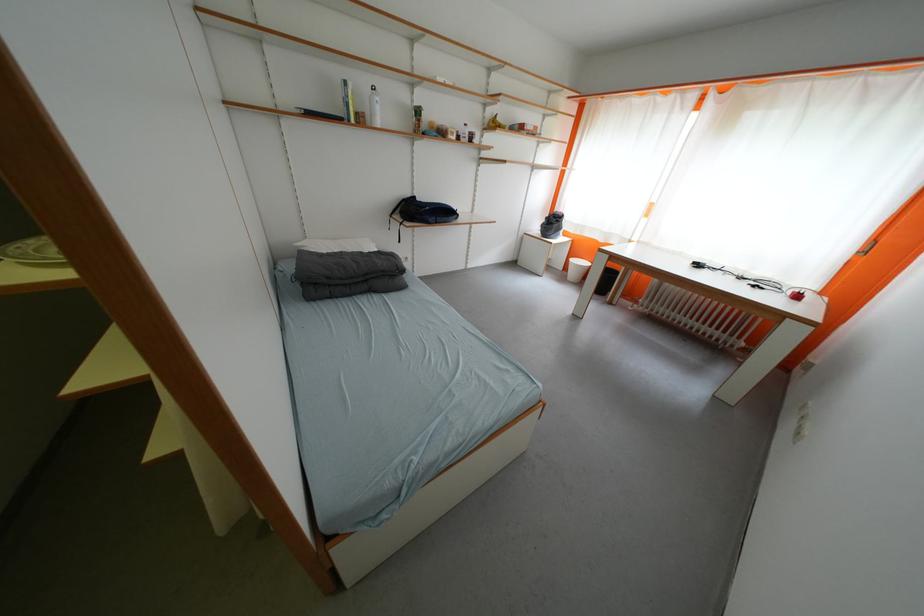
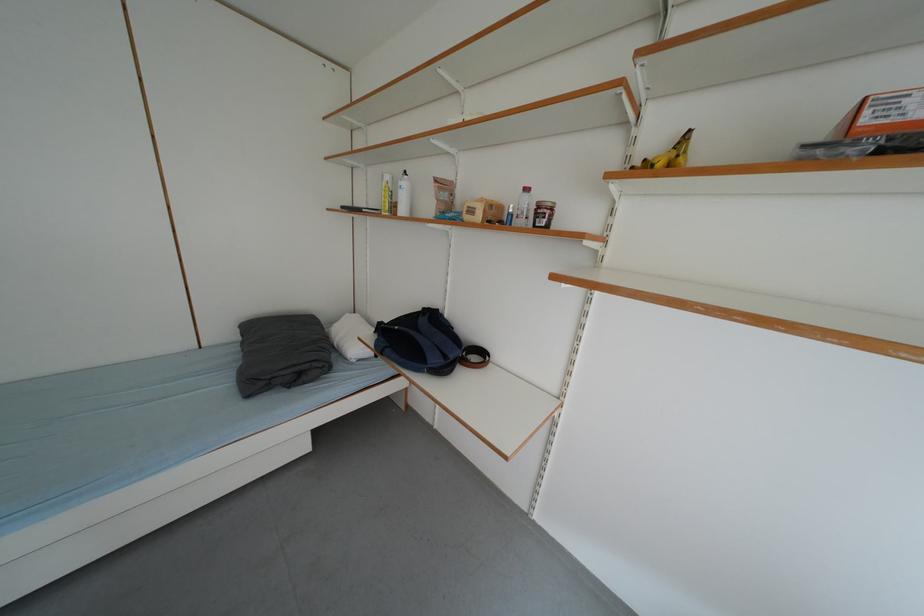
Where in the second image is the point corresponding to pixel 464 140 from the first image?

(487, 220)